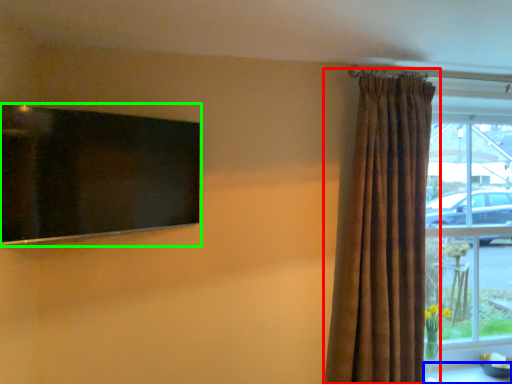
Question: Which object is the farthest from curtain (highlighted by a red box)? Choose among these: table (highlighted by a blue box) or window screen (highlighted by a green box).

Choices:
 (A) table
 (B) window screen

Answer: (B)